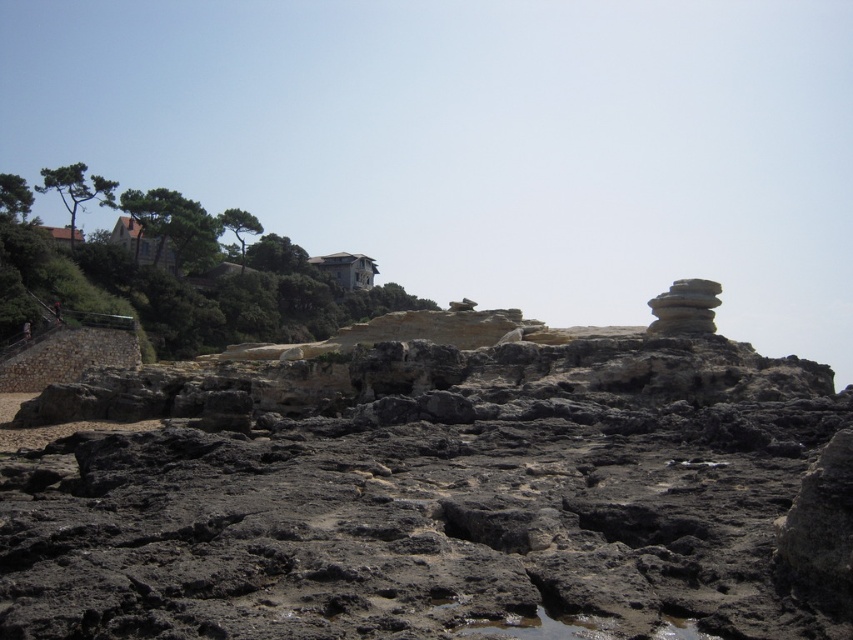
You are a geologist examining the coastal landscape. You have a measuring tape and need to determine if the rough textured rock at center can fit through a gap between two smooth gray rock at upper right. Can it fit based on their sizes?

The rough textured rock at center is wider than the smooth gray rock at upper right. Since the gap between the two smooth gray rocks is likely narrower than the width of the rough textured rock at center, it would not fit through the gap.

You are a geologist examining the coastal landscape. You notice the rough textured rock at center and the smooth gray rock at upper right. Which rock is located to the right of the other?

The rough textured rock at center is positioned on the left side of smooth gray rock at upper right, so the smooth gray rock at upper right is to the right of the rough textured rock at center.